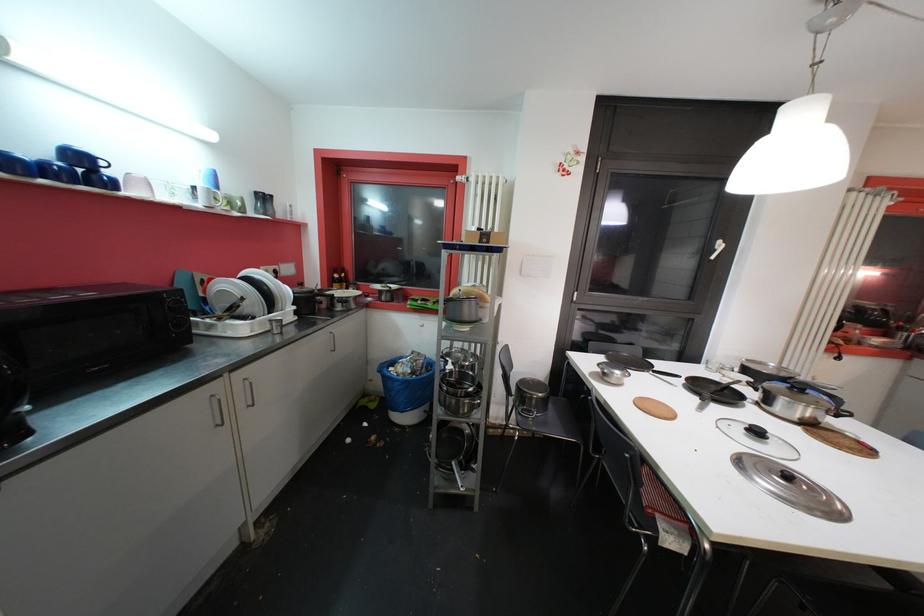
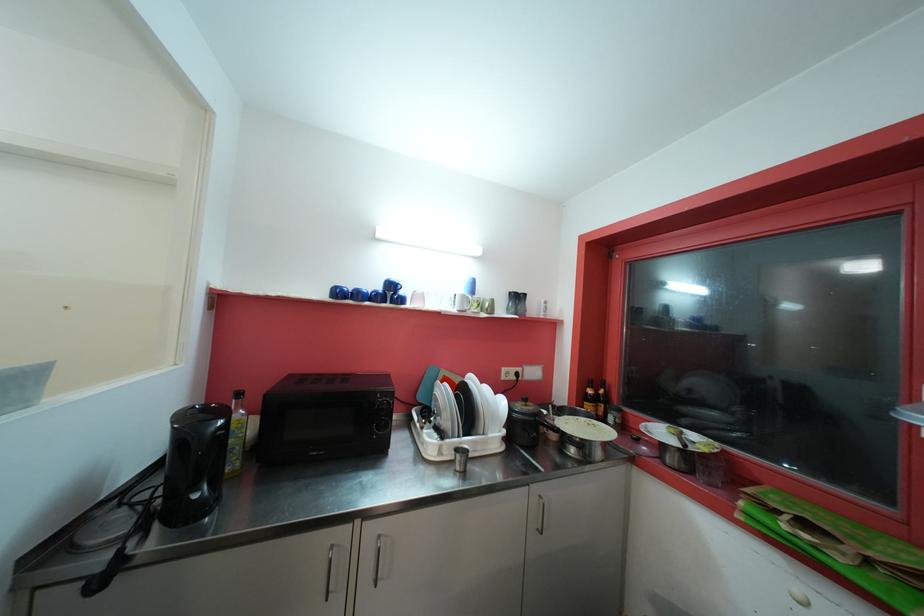
Find the pixel in the second image that matches point (388, 301) in the first image.

(675, 462)